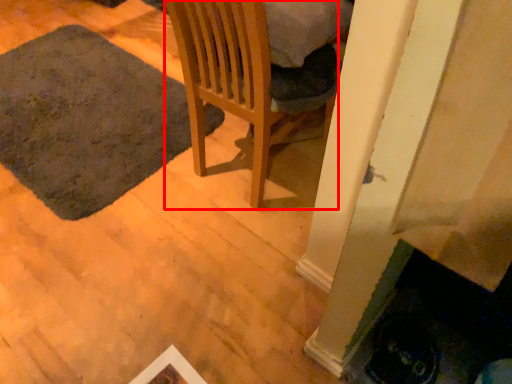
Question: Observing the image, what is the correct spatial positioning of chair (annotated by the red box) in reference to mat?

Choices:
 (A) left
 (B) right

Answer: (B)